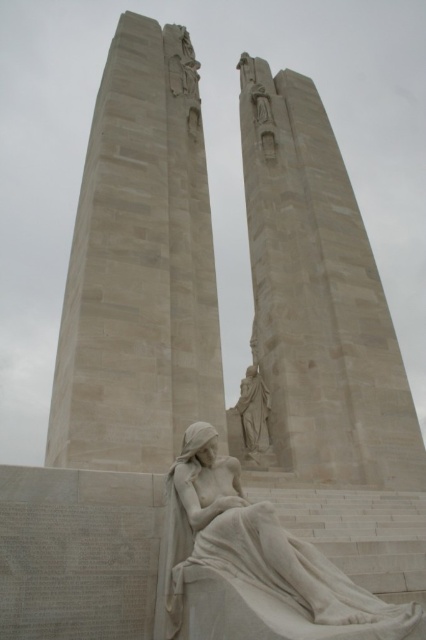
Who is positioned more to the right, light beige stone obelisk at center or white marble statue at lower center?

light beige stone obelisk at center

Does light beige stone obelisk at center have a smaller size compared to white marble statue at lower center?

No, light beige stone obelisk at center is not smaller than white marble statue at lower center.

Who is more forward, (405, 419) or (187, 570)?

Point (187, 570)

Locate an element on the screen. light beige stone obelisk at center is located at coordinates (319, 296).

Can you confirm if white marble statue at lower center is shorter than white marble statue at center?

No.

Does white marble statue at lower center appear on the left side of white marble statue at center?

Indeed, white marble statue at lower center is positioned on the left side of white marble statue at center.

What do you see at coordinates (252, 564) in the screenshot?
I see `white marble statue at lower center` at bounding box center [252, 564].

Locate an element on the screen. Image resolution: width=426 pixels, height=640 pixels. white marble statue at lower center is located at coordinates (252, 564).

Can you confirm if light beige stone monument at center is taller than white marble statue at lower center?

Indeed, light beige stone monument at center has a greater height compared to white marble statue at lower center.

Between light beige stone monument at center and white marble statue at lower center, which one appears on the right side from the viewer's perspective?

From the viewer's perspective, white marble statue at lower center appears more on the right side.

Between point (124, 440) and point (184, 467), which one is positioned behind?

Positioned behind is point (124, 440).

Where is `light beige stone monument at center`? This screenshot has height=640, width=426. light beige stone monument at center is located at coordinates (140, 268).